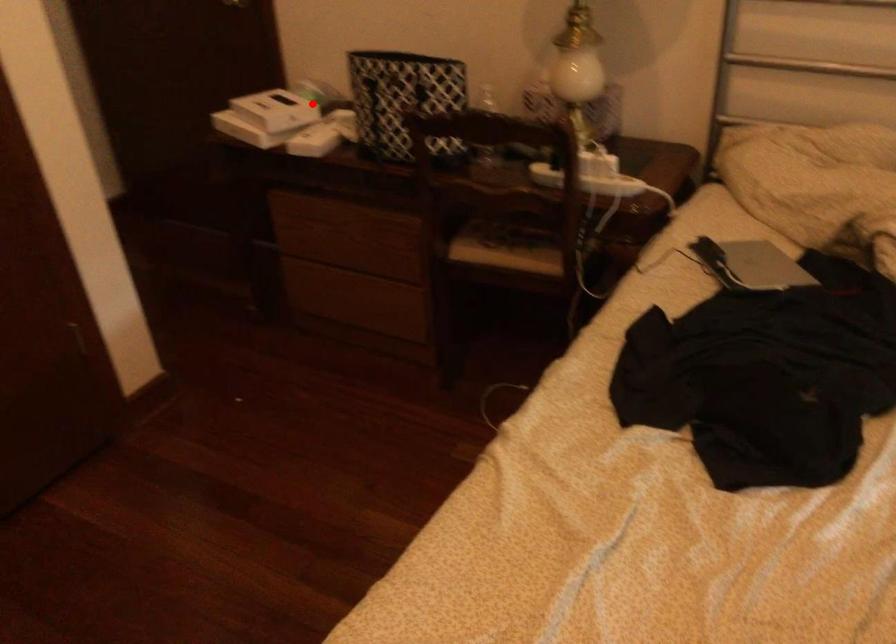
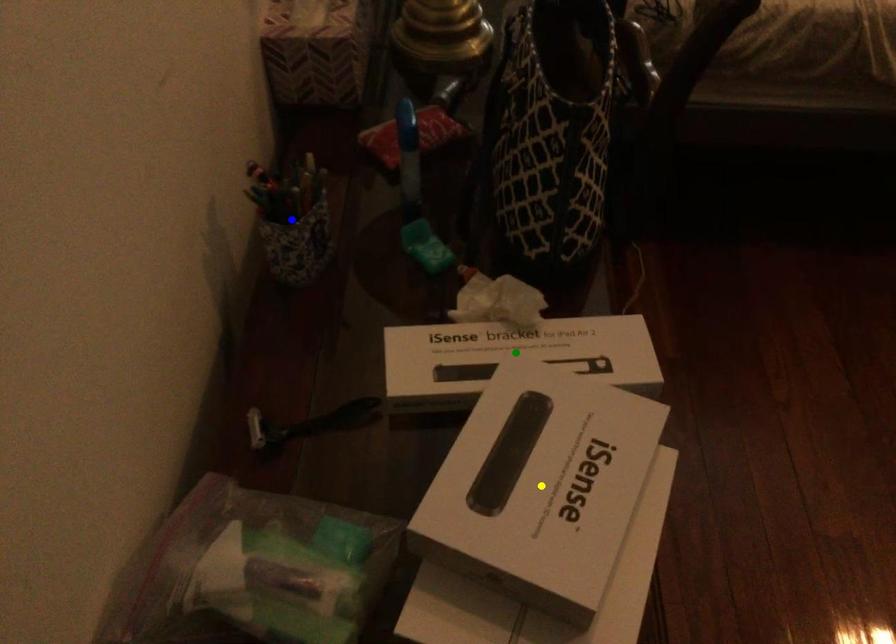
Question: I am providing you with two images of the same scene from different viewpoints. A red point is marked on the first image. You are given multiple points on the second image. Which mark in image 2 goes with the point in image 1?

Choices:
 (A) blue point
 (B) yellow point
 (C) green point

Answer: (C)